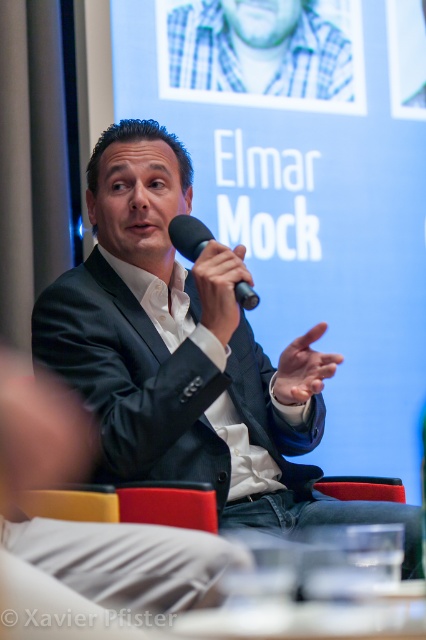
Consider the image. Who is positioned more to the right, blue plaid shirt at upper center or black matte microphone at upper center?

blue plaid shirt at upper center is more to the right.

What do you see at coordinates (264, 52) in the screenshot?
I see `blue plaid shirt at upper center` at bounding box center [264, 52].

The image size is (426, 640). Find the location of `blue plaid shirt at upper center`. blue plaid shirt at upper center is located at coordinates [x=264, y=52].

The width and height of the screenshot is (426, 640). What are the coordinates of `black suit at center` in the screenshot? It's located at (187, 355).

The width and height of the screenshot is (426, 640). I want to click on black suit at center, so click(187, 355).

Is black suit at center taller than blue plaid shirt at upper center?

Indeed, black suit at center has a greater height compared to blue plaid shirt at upper center.

Does black suit at center have a lesser width compared to blue plaid shirt at upper center?

In fact, black suit at center might be wider than blue plaid shirt at upper center.

This screenshot has width=426, height=640. I want to click on black suit at center, so click(187, 355).

I want to click on black suit at center, so click(187, 355).